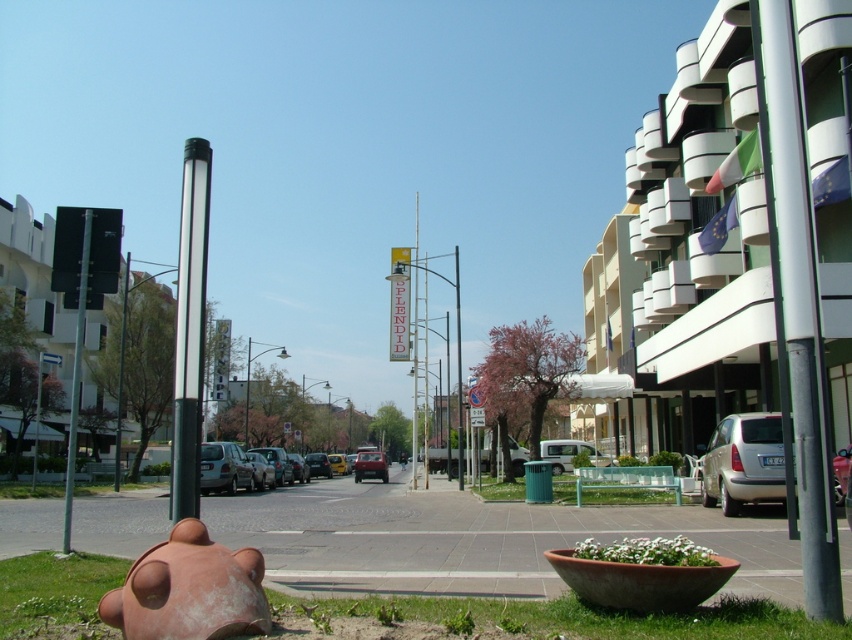
Does polished metal pole at center lie in front of white matte van at center?

That is True.

Does point (205, 216) come behind point (568, 444)?

No, it is in front of (568, 444).

Is point (193, 232) positioned in front of point (545, 452)?

Yes, point (193, 232) is closer to viewer.

This screenshot has width=852, height=640. I want to click on polished metal pole at center, so click(x=190, y=330).

From the picture: Does matte silver car at center have a greater width compared to silver metallic van at center?

Yes.

Does matte silver car at center lie in front of silver metallic van at center?

No, it is not.

The height and width of the screenshot is (640, 852). What are the coordinates of `matte silver car at center` in the screenshot? It's located at click(x=242, y=467).

Does point (793, 595) lie in front of point (734, 449)?

That is True.

Between smooth concrete pavement at center and silver metallic van at lower right, which one is positioned lower?

smooth concrete pavement at center is below.

Which is behind, point (680, 509) or point (692, 468)?

The point (692, 468) is behind.

The width and height of the screenshot is (852, 640). What are the coordinates of `smooth concrete pavement at center` in the screenshot? It's located at (471, 540).